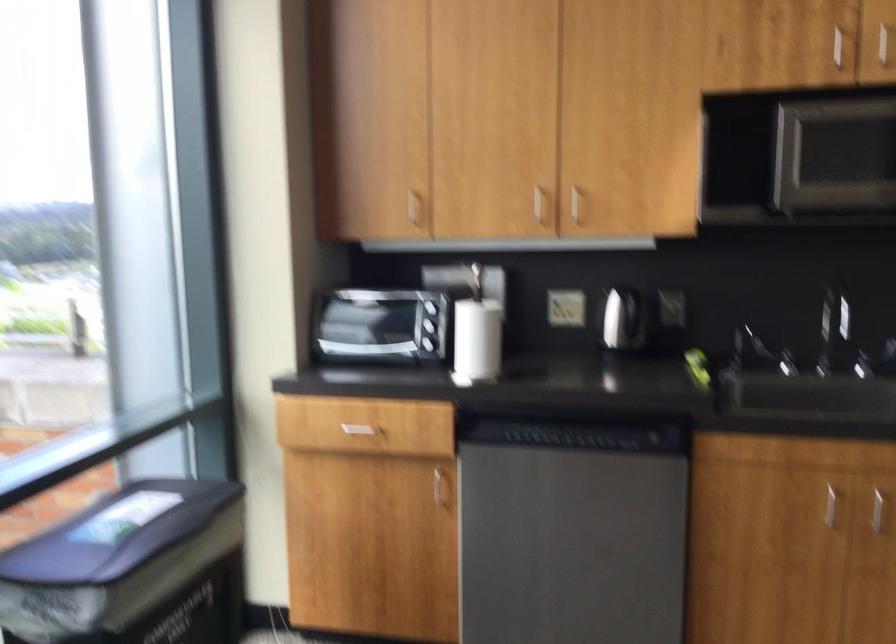
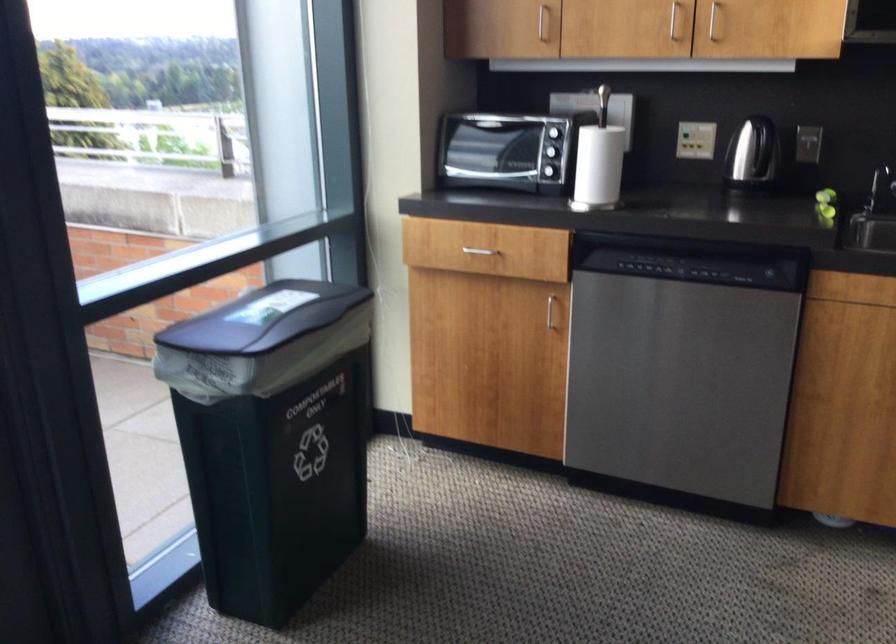
Where in the second image is the point corresponding to the point at 485,341 from the first image?

(599, 165)